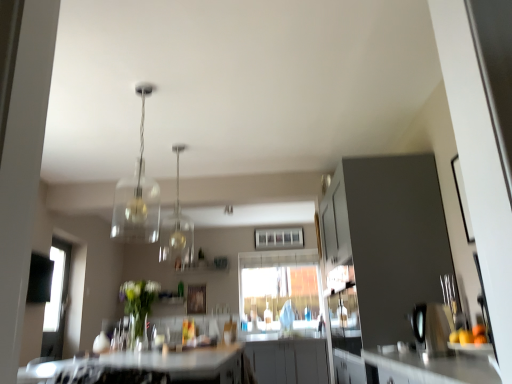
Question: Can you confirm if wooden cutting board at right is bigger than clear glass pendant light at center, which is counted as the 2th light fixture, starting from the front?

Choices:
 (A) yes
 (B) no

Answer: (B)

Question: Can you confirm if wooden cutting board at right is thinner than clear glass pendant light at center, the 1th light fixture viewed from the back?

Choices:
 (A) yes
 (B) no

Answer: (B)

Question: From a real-world perspective, is wooden cutting board at right on top of clear glass pendant light at center, the 1th light fixture viewed from the back?

Choices:
 (A) yes
 (B) no

Answer: (B)

Question: Is clear glass pendant light at center, which is counted as the 2th light fixture, starting from the front, located within wooden cutting board at right?

Choices:
 (A) no
 (B) yes

Answer: (A)

Question: Is wooden cutting board at right oriented towards clear glass pendant light at center, which is counted as the 2th light fixture, starting from the front?

Choices:
 (A) no
 (B) yes

Answer: (A)

Question: Is wooden cutting board at right not within clear glass pendant light at center, which is counted as the 2th light fixture, starting from the front?

Choices:
 (A) yes
 (B) no

Answer: (A)

Question: From the image's perspective, is clear glass pendant light at upper center, marked as the 2th light fixture in a back-to-front arrangement, located above clear glass pendant light at center, which is counted as the 2th light fixture, starting from the front?

Choices:
 (A) no
 (B) yes

Answer: (B)

Question: Is clear glass pendant light at upper center, marked as the 2th light fixture in a back-to-front arrangement, closer to camera compared to clear glass pendant light at center, which is counted as the 2th light fixture, starting from the front?

Choices:
 (A) yes
 (B) no

Answer: (A)

Question: Can you confirm if clear glass pendant light at upper center, marked as the 2th light fixture in a back-to-front arrangement, is positioned to the right of clear glass pendant light at center, which is counted as the 2th light fixture, starting from the front?

Choices:
 (A) no
 (B) yes

Answer: (A)

Question: Considering the relative sizes of clear glass pendant light at upper center, marked as the 2th light fixture in a back-to-front arrangement, and clear glass pendant light at center, the 1th light fixture viewed from the back, in the image provided, is clear glass pendant light at upper center, marked as the 2th light fixture in a back-to-front arrangement, shorter than clear glass pendant light at center, the 1th light fixture viewed from the back,?

Choices:
 (A) yes
 (B) no

Answer: (B)

Question: From the image's perspective, is clear glass pendant light at upper center, positioned as the first light fixture in front-to-back order, located beneath clear glass pendant light at center, which is counted as the 2th light fixture, starting from the front?

Choices:
 (A) no
 (B) yes

Answer: (A)

Question: Does clear glass pendant light at upper center, positioned as the first light fixture in front-to-back order, have a smaller size compared to clear glass pendant light at center, which is counted as the 2th light fixture, starting from the front?

Choices:
 (A) yes
 (B) no

Answer: (B)

Question: Can you confirm if white glossy countertop at lower center is wider than clear glass pendant light at center, which is counted as the 2th light fixture, starting from the front?

Choices:
 (A) no
 (B) yes

Answer: (B)